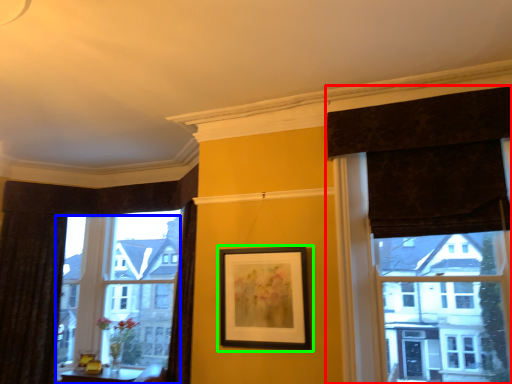
Question: Based on their relative distances, which object is farther from curtain (highlighted by a red box)? Choose from window (highlighted by a blue box) and picture frame (highlighted by a green box).

Choices:
 (A) window
 (B) picture frame

Answer: (A)